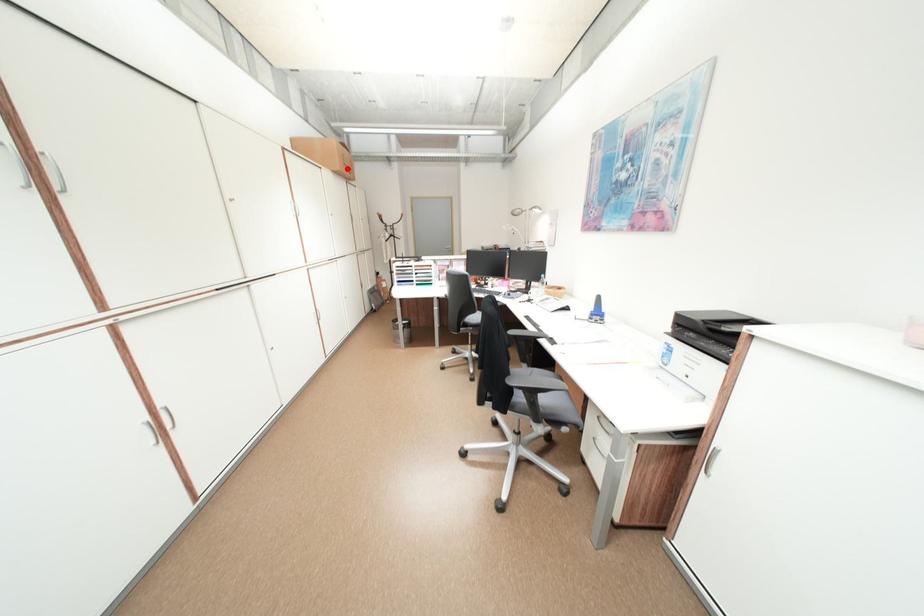
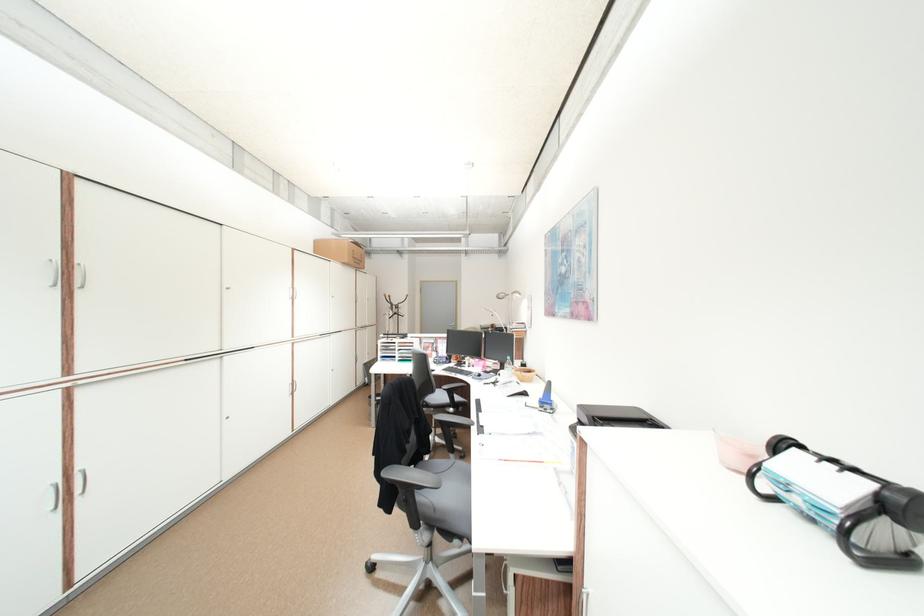
Question: I am providing you with two images of the same scene from different viewpoints. Image1 has a red point marked. In image2, the corresponding 3D location appears at what relative position? Reply with the corresponding letter.

Choices:
 (A) Closer
 (B) Farther

Answer: (B)